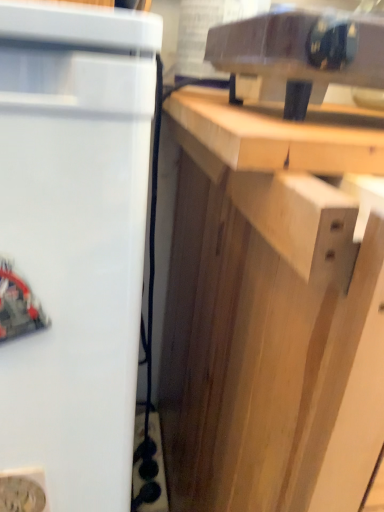
The width and height of the screenshot is (384, 512). What do you see at coordinates (267, 334) in the screenshot?
I see `light wood cabinet at center` at bounding box center [267, 334].

Where is `light brown wood at upper right`? light brown wood at upper right is located at coordinates (279, 135).

You are a GUI agent. You are given a task and a screenshot of the screen. Output one action in this format:
    pyautogui.click(x=<x>, y=<y>)
    Task: Click on the transparent plastic container at upper center
    Image resolution: width=384 pixels, height=512 pixels.
    Given the screenshot: What is the action you would take?
    pyautogui.click(x=299, y=55)

Considering the positions of point (184, 124) and point (56, 333), is point (184, 124) closer or farther from the camera than point (56, 333)?

Point (184, 124) is positioned farther from the camera compared to point (56, 333).

In the scene shown: Considering the sizes of light brown wood at upper right and white matte refrigerator at left in the image, is light brown wood at upper right bigger or smaller than white matte refrigerator at left?

Considering their sizes, light brown wood at upper right takes up less space than white matte refrigerator at left.

Is light brown wood at upper right oriented towards white matte refrigerator at left?

No, light brown wood at upper right is not facing towards white matte refrigerator at left.

Could white matte refrigerator at left be considered to be inside light brown wood at upper right?

No, white matte refrigerator at left is not a part of light brown wood at upper right.

Considering the relative positions of white matte refrigerator at left and transparent plastic container at upper center in the image provided, is white matte refrigerator at left behind transparent plastic container at upper center?

No, white matte refrigerator at left is closer to the camera.

From the image's perspective, is white matte refrigerator at left located beneath transparent plastic container at upper center?

Yes.

Is transparent plastic container at upper center inside white matte refrigerator at left?

No, transparent plastic container at upper center is not inside white matte refrigerator at left.

From a real-world perspective, is white matte refrigerator at left beneath transparent plastic container at upper center?

Correct, in the physical world, white matte refrigerator at left is lower than transparent plastic container at upper center.

Is light wood cabinet at center closer to camera compared to white matte refrigerator at left?

Yes, it is.

In the image, is light wood cabinet at center on the left side or the right side of white matte refrigerator at left?

light wood cabinet at center is positioned on white matte refrigerator at left's right side.

Looking at this image, from a real-world perspective, who is located higher, light wood cabinet at center or white matte refrigerator at left?

white matte refrigerator at left is physically above.

In the image, there is a light wood cabinet at center. At what (x,y) coordinates should I click in order to perform the action: click on refrigerator above it (from the image's perspective). Please return your answer as a coordinate pair (x, y). Looking at the image, I should click on (72, 249).

Looking at this image, could you tell me if white matte refrigerator at left is turned towards light wood cabinet at center?

No, white matte refrigerator at left is not turned towards light wood cabinet at center.

Based on the photo, which is more to the left, white matte refrigerator at left or light wood cabinet at center?

white matte refrigerator at left.

In the image, there is a white matte refrigerator at left. Where is `cabinetry below it (from a real-world perspective)`? The width and height of the screenshot is (384, 512). cabinetry below it (from a real-world perspective) is located at coordinates (267, 334).

Between white matte refrigerator at left and light wood cabinet at center, which one has larger width?

light wood cabinet at center is wider.

Which is more to the left, light wood cabinet at center or transparent plastic container at upper center?

transparent plastic container at upper center is more to the left.

Is light wood cabinet at center surrounding transparent plastic container at upper center?

Definitely not — transparent plastic container at upper center is not inside light wood cabinet at center.

Looking at this image, is light wood cabinet at center positioned far away from transparent plastic container at upper center?

They are positioned close to each other.

Which of these two, light wood cabinet at center or transparent plastic container at upper center, is thinner?

transparent plastic container at upper center.

From a real-world perspective, is transparent plastic container at upper center positioned over light brown wood at upper right based on gravity?

Yes, from a real-world perspective, transparent plastic container at upper center is on top of light brown wood at upper right.

Is transparent plastic container at upper center turned away from light brown wood at upper right?

No, transparent plastic container at upper center's orientation is not away from light brown wood at upper right.

How different are the orientations of transparent plastic container at upper center and light brown wood at upper right in degrees?

The facing directions of transparent plastic container at upper center and light brown wood at upper right are 0.912 degrees apart.

Is transparent plastic container at upper center far from light brown wood at upper right?

No, transparent plastic container at upper center is not far away from light brown wood at upper right.

From a real-world perspective, who is located lower, light brown wood at upper right or transparent plastic container at upper center?

light brown wood at upper right, from a real-world perspective.

At what (x,y) coordinates should I click in order to perform the action: click on counter top on the left of transparent plastic container at upper center. Please return your answer as a coordinate pair (x, y). Looking at the image, I should click on (279, 135).

Between light brown wood at upper right and transparent plastic container at upper center, which one appears on the left side from the viewer's perspective?

From the viewer's perspective, light brown wood at upper right appears more on the left side.

Which is in front, point (329, 159) or point (299, 39)?

The point (329, 159) is closer.

At what (x,y) coordinates should I click in order to perform the action: click on refrigerator directly beneath the light brown wood at upper right (from a real-world perspective). Please return your answer as a coordinate pair (x, y). Looking at the image, I should click on (72, 249).

You are a GUI agent. You are given a task and a screenshot of the screen. Output one action in this format:
    pyautogui.click(x=<x>, y=<y>)
    Task: Click on the refrigerator located below the transparent plastic container at upper center (from the image's perspective)
    Image resolution: width=384 pixels, height=512 pixels.
    Given the screenshot: What is the action you would take?
    pyautogui.click(x=72, y=249)

Based on their spatial positions, is light brown wood at upper right or white matte refrigerator at left closer to light wood cabinet at center?

light brown wood at upper right is positioned closer to the anchor light wood cabinet at center.

Considering their positions, is light wood cabinet at center positioned further to light brown wood at upper right than white matte refrigerator at left?

white matte refrigerator at left lies further to light brown wood at upper right than the other object.

Which object lies further to the anchor point light wood cabinet at center, white matte refrigerator at left or transparent plastic container at upper center?

Among the two, transparent plastic container at upper center is located further to light wood cabinet at center.

Looking at the image, which one is located closer to light wood cabinet at center, light brown wood at upper right or transparent plastic container at upper center?

light brown wood at upper right lies closer to light wood cabinet at center than the other object.

Looking at the image, which one is located further to transparent plastic container at upper center, light brown wood at upper right or white matte refrigerator at left?

white matte refrigerator at left is positioned further to the anchor transparent plastic container at upper center.

Estimate the real-world distances between objects in this image. Which object is further from light brown wood at upper right, transparent plastic container at upper center or light wood cabinet at center?

light wood cabinet at center lies further to light brown wood at upper right than the other object.

Looking at this image, from the image, which object appears to be farther from light wood cabinet at center, transparent plastic container at upper center or light brown wood at upper right?

transparent plastic container at upper center lies further to light wood cabinet at center than the other object.

Based on their spatial positions, is light brown wood at upper right or transparent plastic container at upper center closer to white matte refrigerator at left?

Among the two, light brown wood at upper right is located nearer to white matte refrigerator at left.

I want to click on appliance situated between white matte refrigerator at left and light wood cabinet at center from left to right, so click(299, 55).

Locate an element on the screen. The image size is (384, 512). counter top located between white matte refrigerator at left and transparent plastic container at upper center in the left-right direction is located at coordinates (279, 135).

Find the location of `counter top between white matte refrigerator at left and light wood cabinet at center in the horizontal direction`. counter top between white matte refrigerator at left and light wood cabinet at center in the horizontal direction is located at coordinates (279, 135).

In order to click on counter top between transparent plastic container at upper center and light wood cabinet at center vertically in this screenshot , I will do (279, 135).